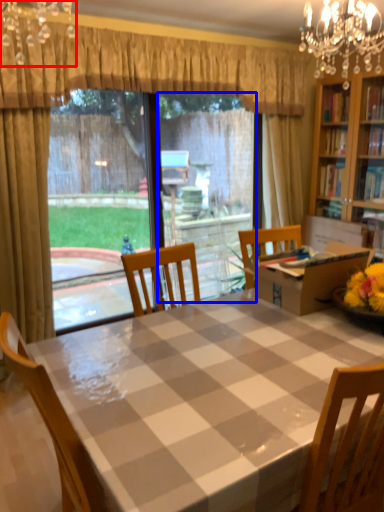
Question: Which of the following is the farthest to the observer, light fixture (highlighted by a red box) or window screen (highlighted by a blue box)?

Choices:
 (A) light fixture
 (B) window screen

Answer: (B)